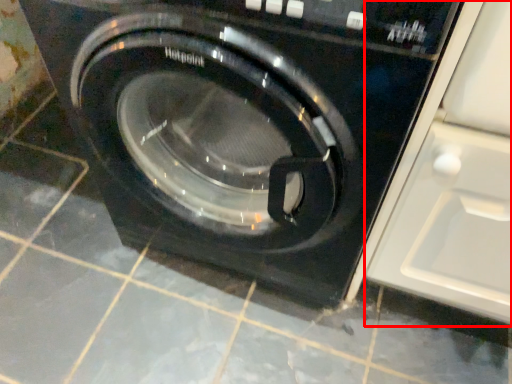
Question: From the image, what is the correct spatial relationship of glass door (annotated by the red box) in relation to washing machine?

Choices:
 (A) right
 (B) left

Answer: (A)